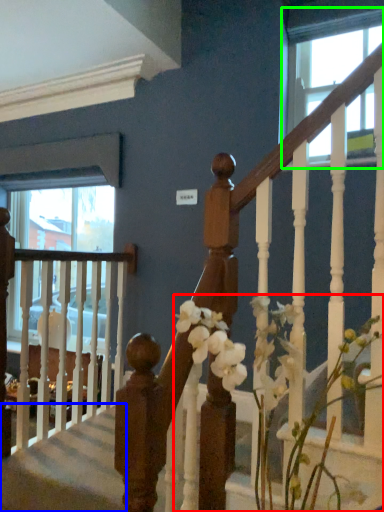
Question: Which is nearer to the floral arrangement (highlighted by a red box)? stairwell (highlighted by a blue box) or window (highlighted by a green box).

Choices:
 (A) stairwell
 (B) window

Answer: (A)